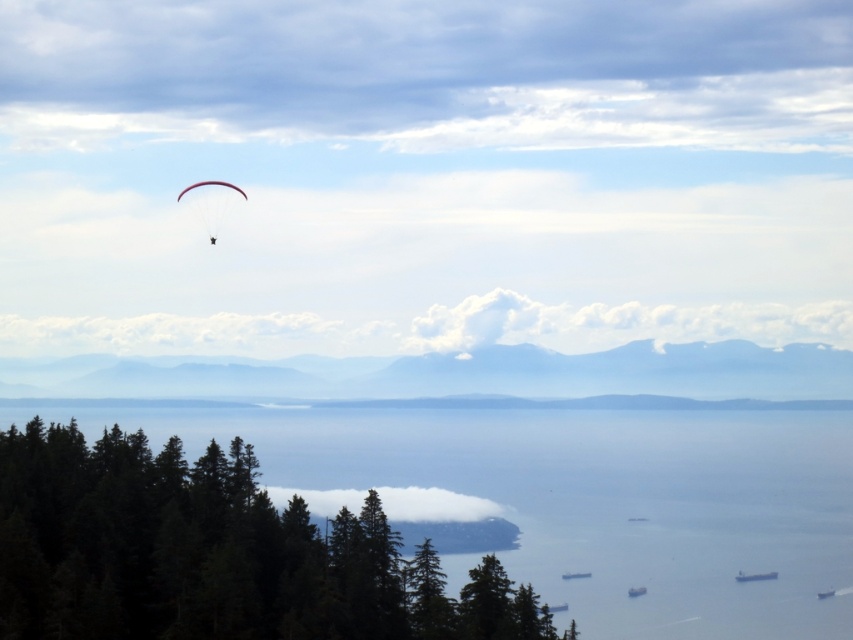
Question: Can you confirm if green matte trees at lower left is positioned below white fluffy cloud at center?

Choices:
 (A) yes
 (B) no

Answer: (B)

Question: Among these objects, which one is farthest from the camera?

Choices:
 (A) white fluffy cloud at center
 (B) green matte trees at lower left
 (C) matte white parachute at upper left

Answer: (C)

Question: Does white fluffy cloud at center have a larger size compared to matte white parachute at upper left?

Choices:
 (A) no
 (B) yes

Answer: (B)

Question: Estimate the real-world distances between objects in this image. Which object is farther from the white fluffy cloud at center?

Choices:
 (A) matte white parachute at upper left
 (B) green matte trees at lower left

Answer: (A)

Question: Which object appears closest to the camera in this image?

Choices:
 (A) matte white parachute at upper left
 (B) green matte trees at lower left
 (C) white fluffy cloud at center

Answer: (B)

Question: Considering the relative positions of green matte trees at lower left and matte white parachute at upper left in the image provided, where is green matte trees at lower left located with respect to matte white parachute at upper left?

Choices:
 (A) left
 (B) right

Answer: (B)